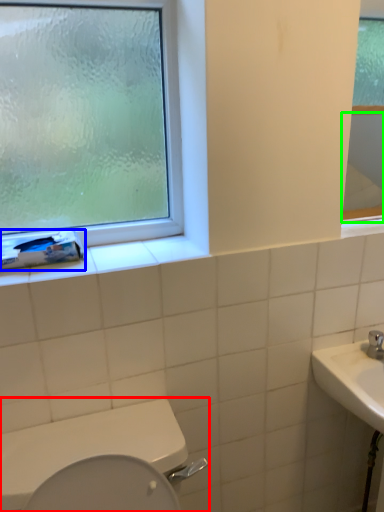
Question: Which object is positioned farthest from toilet (highlighted by a red box)? Select from toilet paper (highlighted by a blue box) and mirror (highlighted by a green box).

Choices:
 (A) toilet paper
 (B) mirror

Answer: (B)